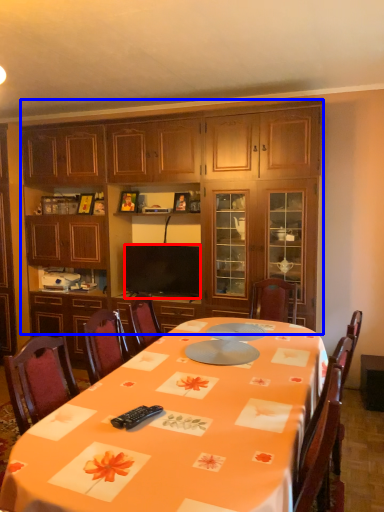
Question: Among these objects, which one is nearest to the camera, television (highlighted by a red box) or cabinetry (highlighted by a blue box)?

Choices:
 (A) television
 (B) cabinetry

Answer: (B)